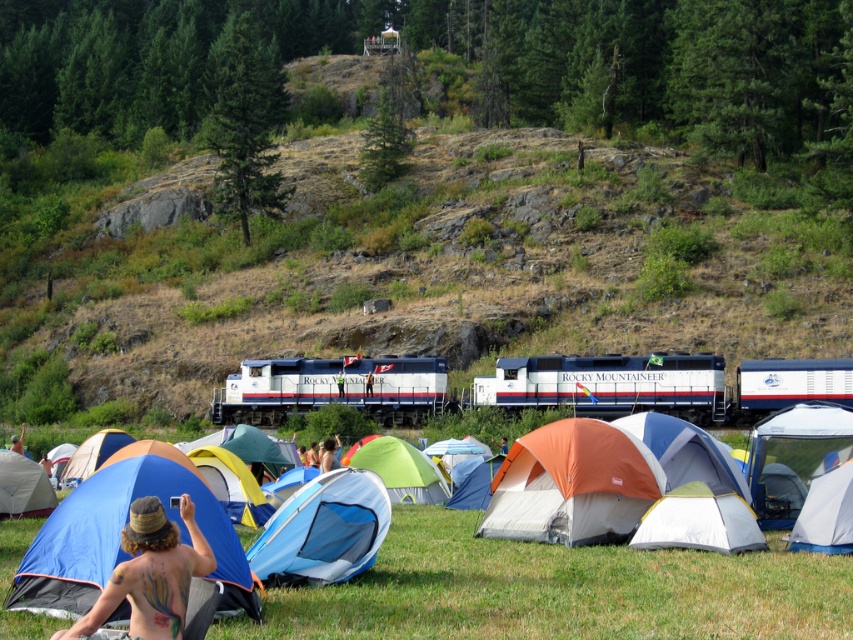
You are a photographer standing at the edge of the camping area and want to capture both the white glossy train at center and the white nylon tent at center in a single photo. Which object should you adjust your focus on first to ensure both are in the frame?

The white glossy train at center is closer to you than the white nylon tent at center, so you should focus on the white glossy train at center first to ensure both are in the frame.

You are setting up a tent for a family of four and need to choose between the blue fabric tent at center and the green fabric tent at center. Based on their sizes, which tent would be more suitable for accommodating more people?

The green fabric tent at center has a greater width than the blue fabric tent at center, making it more suitable for accommodating more people.

You are standing at the point marked as point (323, 531) in the image. What object is located exactly at this point?

The blue fabric tent at center is located exactly at point (323, 531).